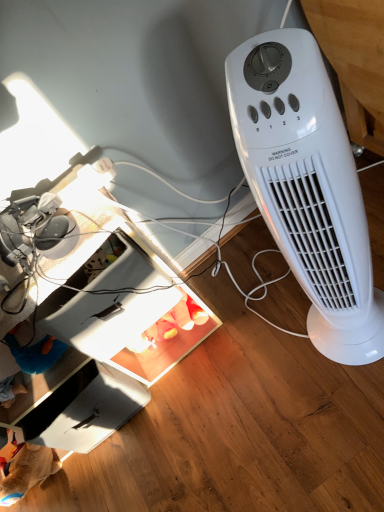
I want to click on vacant space situated on the left part of white plastic heater at right, so click(295, 373).